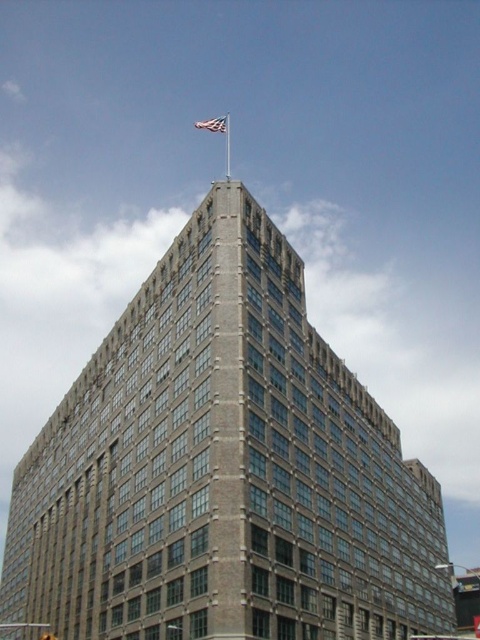
Question: Which object appears closest to the camera in this image?

Choices:
 (A) silver metallic flag pole at upper center
 (B) white fabric flag at top

Answer: (A)

Question: Can you confirm if white fabric flag at top is positioned to the right of silver metallic flag pole at upper center?

Choices:
 (A) no
 (B) yes

Answer: (A)

Question: Is white fabric flag at top positioned at the back of silver metallic flag pole at upper center?

Choices:
 (A) no
 (B) yes

Answer: (B)

Question: Can you confirm if white fabric flag at top is bigger than silver metallic flag pole at upper center?

Choices:
 (A) no
 (B) yes

Answer: (A)

Question: Which object appears closest to the camera in this image?

Choices:
 (A) white fabric flag at top
 (B) silver metallic flag pole at upper center

Answer: (B)